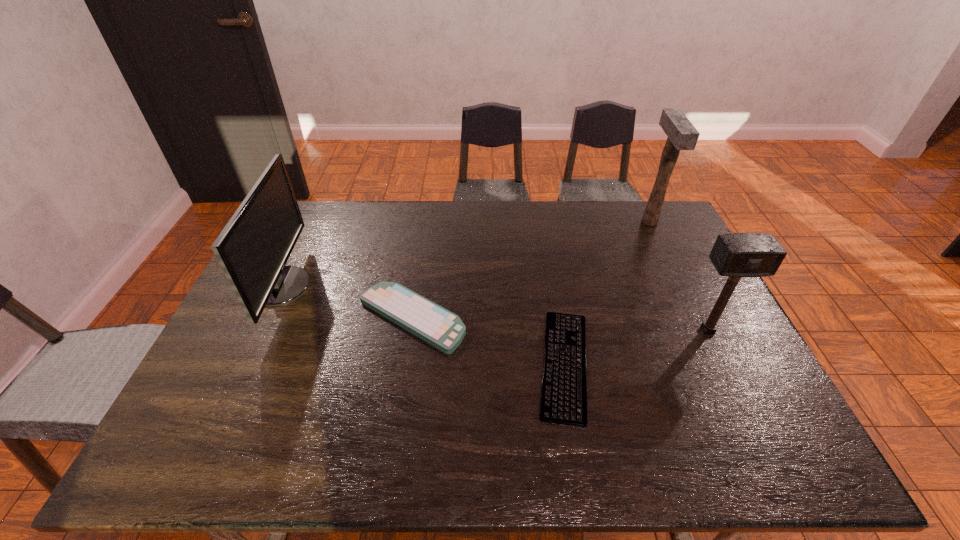
Find the location of `the farther mallet`. the farther mallet is located at coordinates (682, 135).

The height and width of the screenshot is (540, 960). What are the coordinates of `the taller mallet` in the screenshot? It's located at (682, 135).

The image size is (960, 540). What are the coordinates of `the leftmost object` in the screenshot? It's located at (253, 248).

Locate an element on the screen. The height and width of the screenshot is (540, 960). the shorter mallet is located at coordinates (736, 255).

At what (x,y) coordinates should I click in order to perform the action: click on the left computer keyboard. Please return your answer as a coordinate pair (x, y). This screenshot has width=960, height=540. Looking at the image, I should click on (439, 327).

In order to click on the taller computer keyboard in this screenshot , I will do `click(439, 327)`.

Find the location of a particular element. This screenshot has width=960, height=540. the right computer keyboard is located at coordinates (563, 400).

This screenshot has width=960, height=540. Find the location of `the shortest object`. the shortest object is located at coordinates (563, 400).

This screenshot has width=960, height=540. I want to click on vacant area situated 0.060m on the left of the taller mallet, so click(x=625, y=221).

The image size is (960, 540). In order to click on vacant region located on the screen side of the leftmost object in this screenshot , I will do `click(325, 286)`.